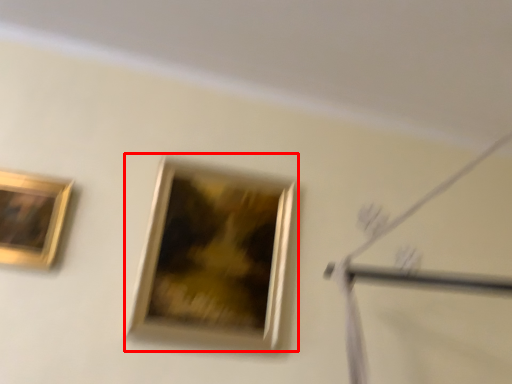
Question: From the image's perspective, considering the relative positions of picture frame (annotated by the red box) and picture frame in the image provided, where is picture frame (annotated by the red box) located with respect to the staircase?

Choices:
 (A) below
 (B) above

Answer: (A)